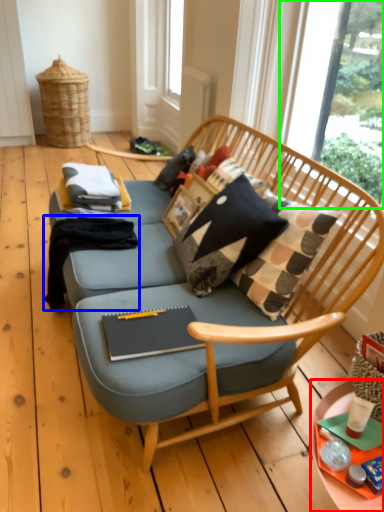
Question: Which object is positioned farthest from desk (highlighted by a red box)? Select from clothing (highlighted by a blue box) and window screen (highlighted by a green box).

Choices:
 (A) clothing
 (B) window screen

Answer: (B)